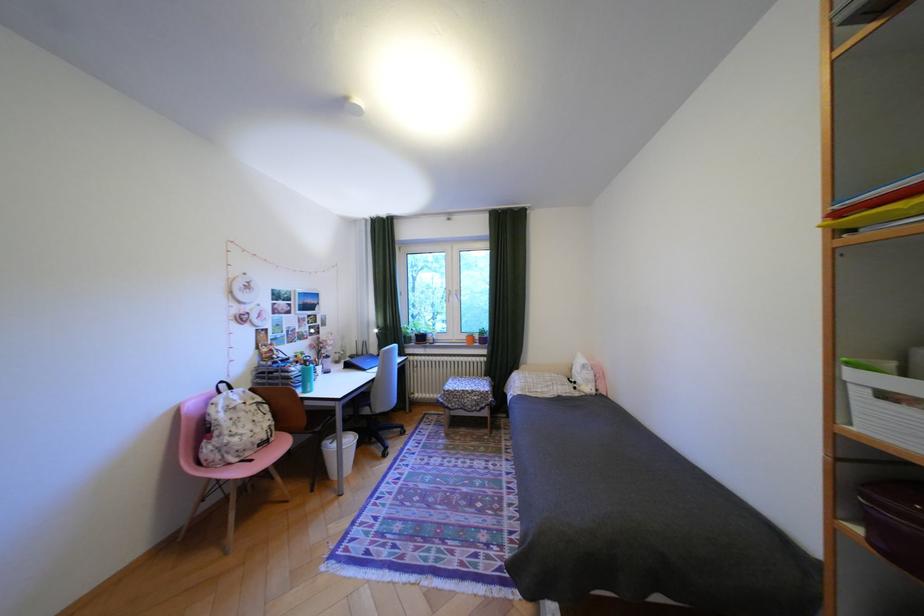
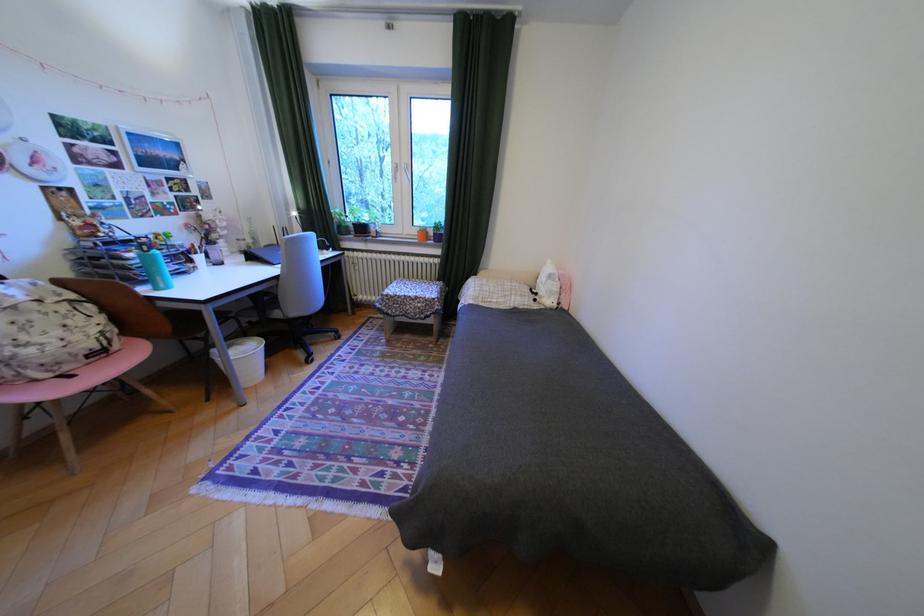
The images are taken continuously from a first-person perspective. In which direction are you moving?

The cameraman walked toward right, forward.